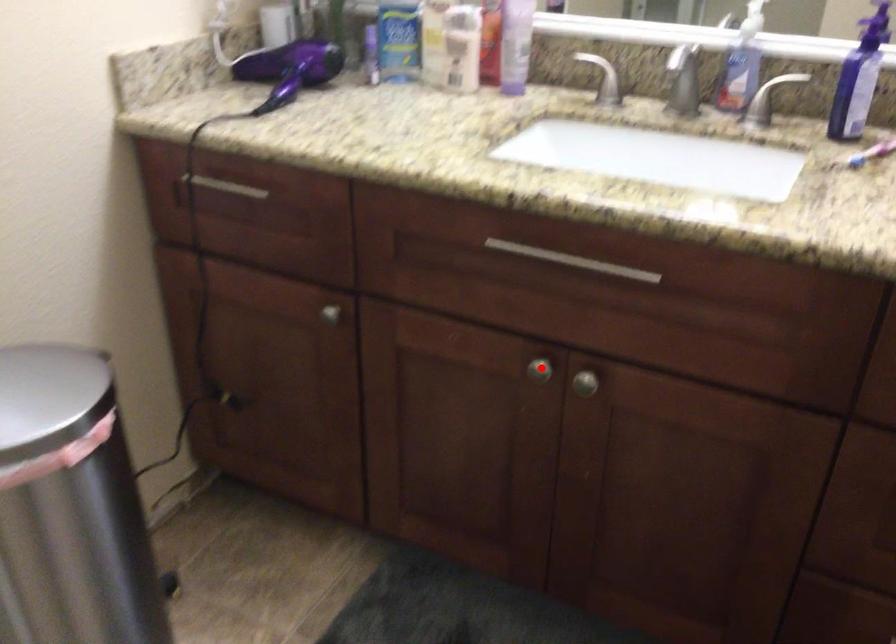
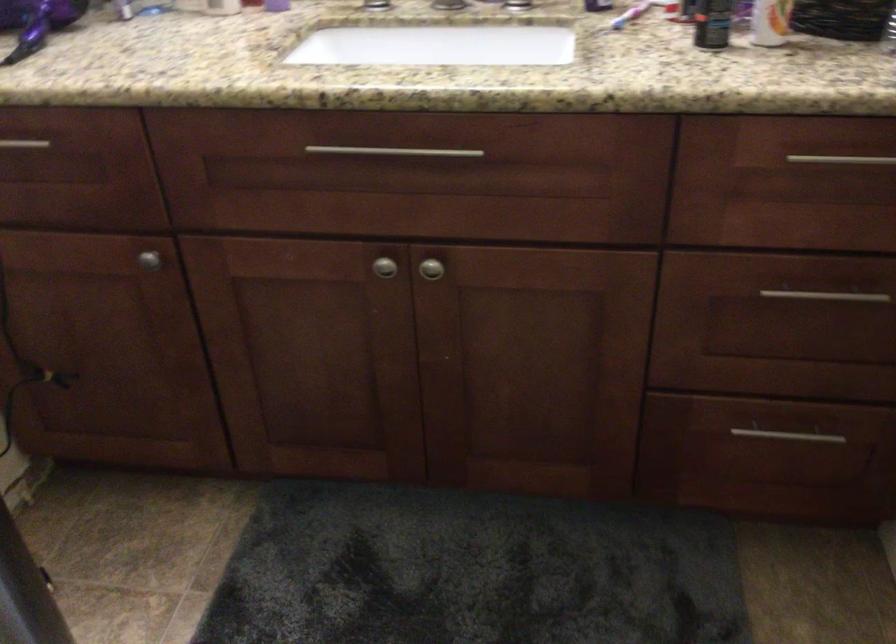
The point at the highlighted location is marked in the first image. Where is the corresponding point in the second image?

(383, 267)